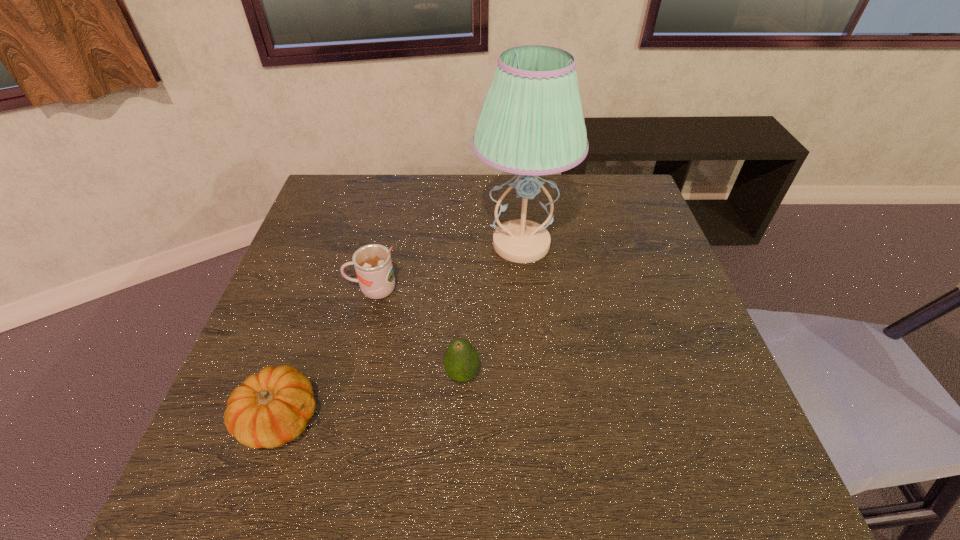
Find the location of a particular element. This screenshot has width=960, height=540. empty space that is in between the second tallest object and the gourd is located at coordinates (326, 354).

You are a GUI agent. You are given a task and a screenshot of the screen. Output one action in this format:
    pyautogui.click(x=<x>, y=<y>)
    Task: Click on the vacant space in between the lamp and the avocado
    
    Given the screenshot: What is the action you would take?
    pyautogui.click(x=492, y=309)

Image resolution: width=960 pixels, height=540 pixels. In order to click on free area in between the lamp and the second tallest object in this screenshot , I will do `click(447, 267)`.

Identify the location of vacant area between the avocado and the lamp. The height and width of the screenshot is (540, 960). (492, 309).

Identify the location of free space between the avocado and the lamp. (492, 309).

At what (x,y) coordinates should I click in order to perform the action: click on free space that is in between the third shortest object and the gourd. Please return your answer as a coordinate pair (x, y). Looking at the image, I should click on (326, 354).

Find the location of `vacant area that lies between the gourd and the tallest object`. vacant area that lies between the gourd and the tallest object is located at coordinates (400, 331).

Locate an element on the screen. The height and width of the screenshot is (540, 960). free point between the avocado and the cup is located at coordinates [x=418, y=332].

Where is `free area in between the tallest object and the avocado`? This screenshot has height=540, width=960. free area in between the tallest object and the avocado is located at coordinates (x=492, y=309).

At what (x,y) coordinates should I click in order to perform the action: click on free space between the tallest object and the avocado. Please return your answer as a coordinate pair (x, y). Image resolution: width=960 pixels, height=540 pixels. Looking at the image, I should click on (492, 309).